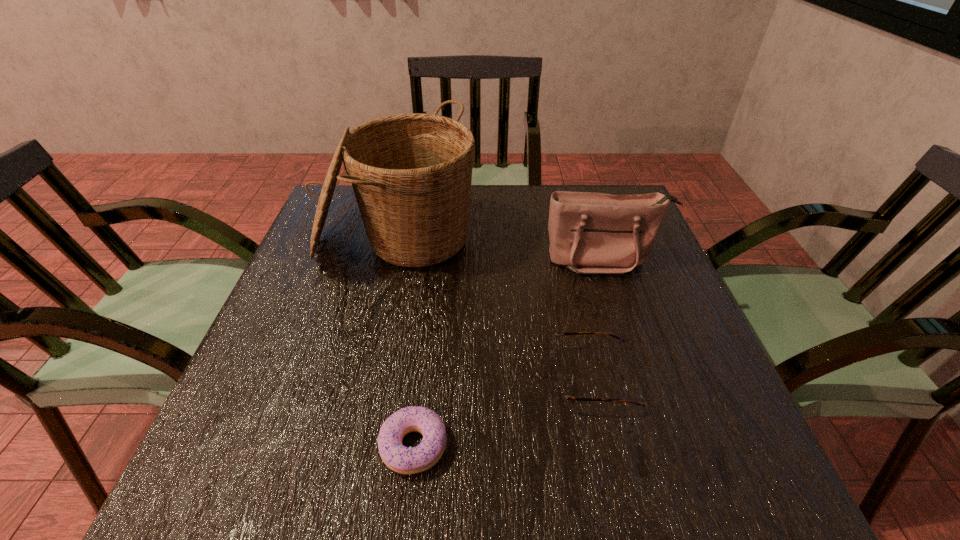
This screenshot has width=960, height=540. I want to click on the tallest object, so click(x=411, y=173).

Where is `the third shortest object`? This screenshot has width=960, height=540. the third shortest object is located at coordinates (590, 233).

This screenshot has width=960, height=540. I want to click on the third farthest object, so click(560, 395).

Find the location of a particular element. the nearest object is located at coordinates (401, 459).

Locate an element on the screen. The height and width of the screenshot is (540, 960). vacant space situated on the front of the tallest object is located at coordinates [x=357, y=414].

Identify the location of vacant space located 0.360m on the front pocket of the third shortest object. (656, 418).

Identify the location of free point located 0.170m on the front-facing side of the third farthest object. (460, 378).

The image size is (960, 540). Identify the location of vacant space situated 0.220m on the front-facing side of the third farthest object. (433, 378).

Where is `vacant space located on the front-facing side of the third farthest object`? Image resolution: width=960 pixels, height=540 pixels. vacant space located on the front-facing side of the third farthest object is located at coordinates pos(343,378).

In order to click on blank space located on the left of the doughnut in this screenshot , I will do `click(216, 446)`.